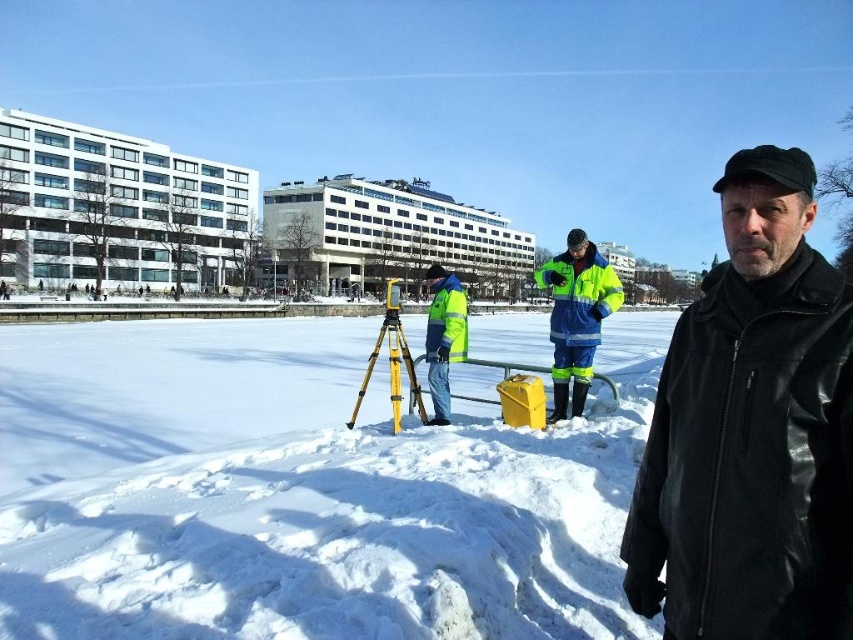
Who is more forward, (801, 216) or (395, 291)?

Point (801, 216) is in front.

Does black leather jacket at center have a greater height compared to yellow matte tripod at center?

In fact, black leather jacket at center may be shorter than yellow matte tripod at center.

Between point (755, 202) and point (409, 380), which one is positioned in front?

Point (755, 202) is more forward.

Where is `black leather jacket at center`? black leather jacket at center is located at coordinates (752, 432).

Between point (543, 284) and point (409, 360), which one is positioned behind?

Point (409, 360)

This screenshot has height=640, width=853. What do you see at coordinates (576, 316) in the screenshot?
I see `high-visibility fabric jacket at center` at bounding box center [576, 316].

What are the coordinates of `high-visibility fabric jacket at center` in the screenshot? It's located at (576, 316).

Is black leather jacket at center positioned in front of high-visibility fabric jacket at center?

Yes, it is in front of high-visibility fabric jacket at center.

Is point (761, 444) more distant than point (581, 362)?

No, (761, 444) is in front of (581, 362).

The height and width of the screenshot is (640, 853). Find the location of `black leather jacket at center`. black leather jacket at center is located at coordinates (752, 432).